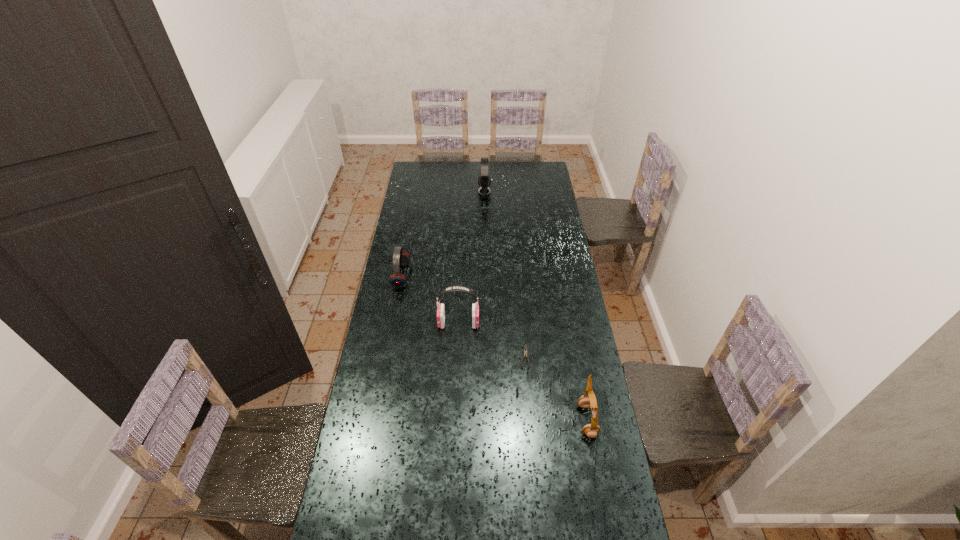
Identify the location of blank area in the image that satisfies the following two spatial constraints: 1. on the outer surface of the pliers; 2. on the right side of the third farthest object. The height and width of the screenshot is (540, 960). (457, 357).

Find the location of a particular element. The width and height of the screenshot is (960, 540). vacant position in the image that satisfies the following two spatial constraints: 1. on the ear cups of the pliers; 2. on the left side of the farthest object is located at coordinates (487, 357).